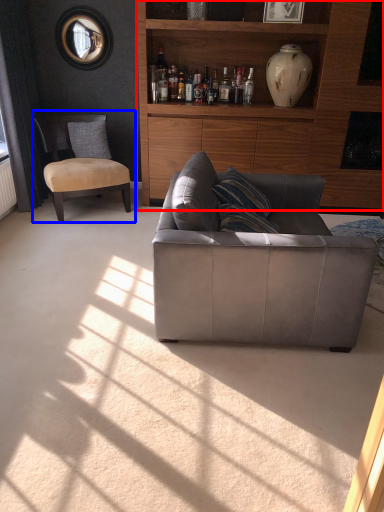
Question: Which object is further to the camera taking this photo, cabinetry (highlighted by a red box) or chair (highlighted by a blue box)?

Choices:
 (A) cabinetry
 (B) chair

Answer: (B)